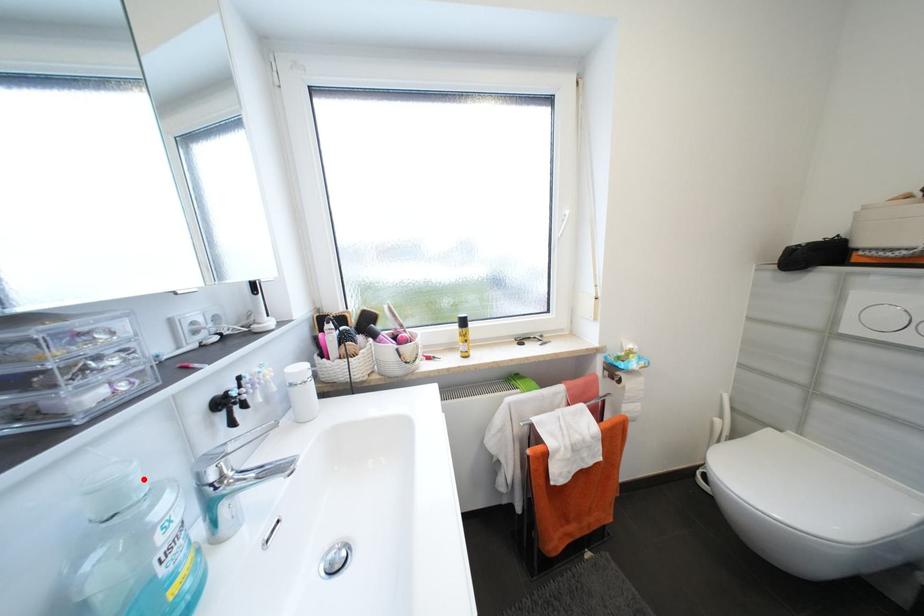
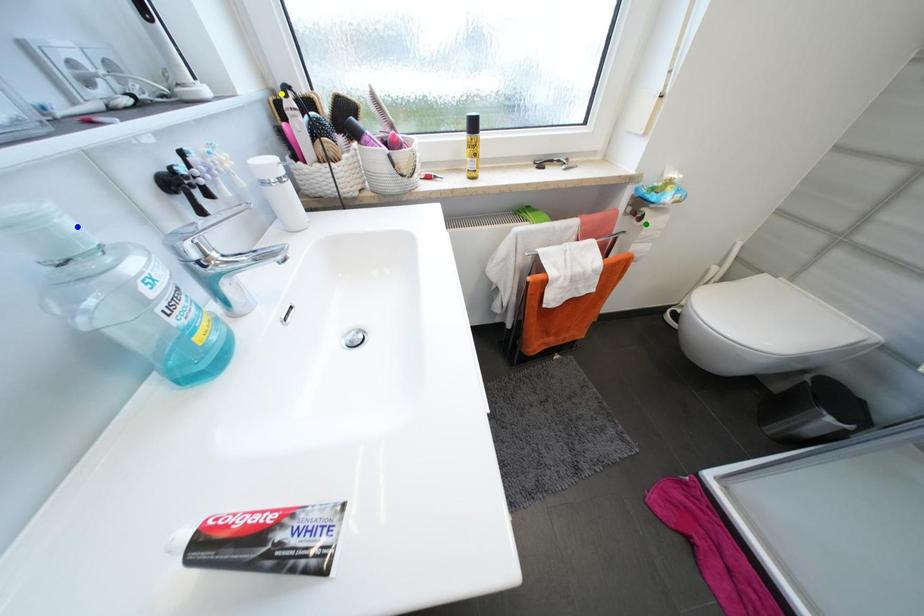
Question: I am providing you with two images of the same scene from different viewpoints. A red point is marked on the first image. You are given multiple points on the second image. Can you choose the point in image 2 that corresponds to the point in image 1?

Choices:
 (A) green point
 (B) yellow point
 (C) blue point

Answer: (C)